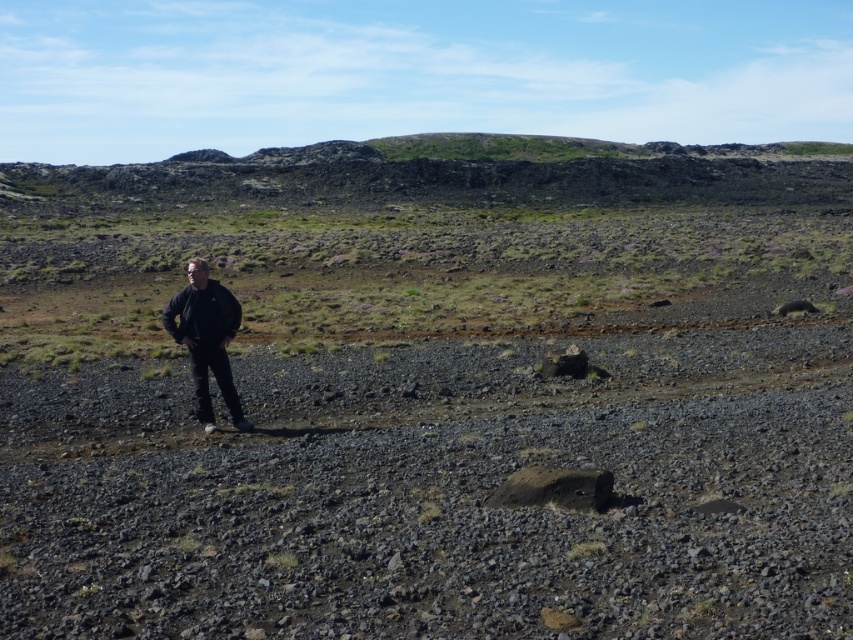
Who is positioned more to the right, black matte jacket at center or smooth gray rock at center?

smooth gray rock at center is more to the right.

How much distance is there between black matte jacket at center and smooth gray rock at center?

black matte jacket at center and smooth gray rock at center are 5.49 meters apart.

Describe the element at coordinates (206, 339) in the screenshot. I see `black matte jacket at center` at that location.

Where is `black matte jacket at center`? The width and height of the screenshot is (853, 640). black matte jacket at center is located at coordinates (206, 339).